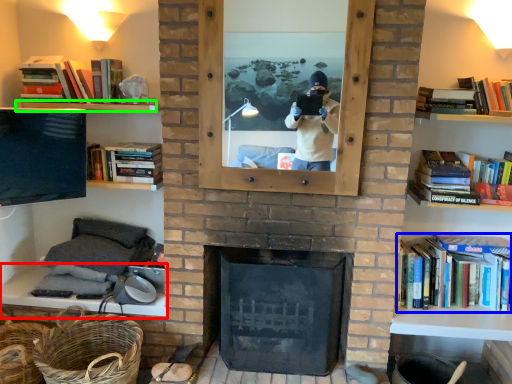
Question: Considering the real-world distances, which object is closest to mantle (highlighted by a red box)? book (highlighted by a blue box) or shelf (highlighted by a green box).

Choices:
 (A) book
 (B) shelf

Answer: (B)